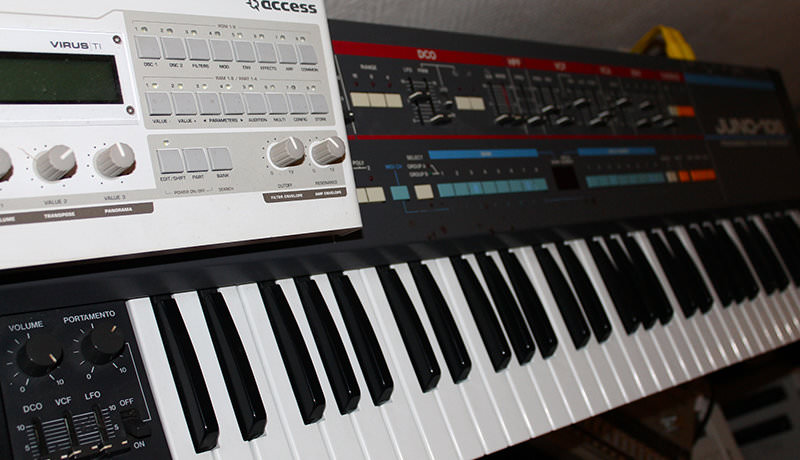
Locate an element on the screen. blurred area below the keyboard is located at coordinates click(666, 430), click(750, 402), click(756, 432).